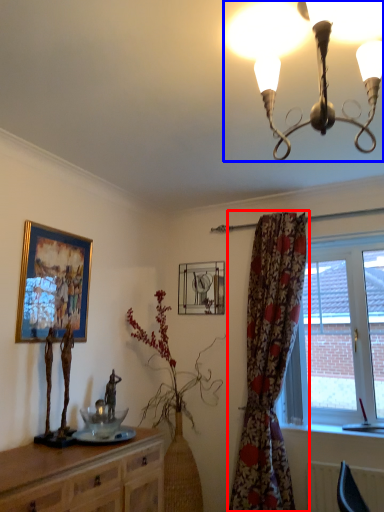
Question: Which point is closer to the camera, curtain (highlighted by a red box) or lamp (highlighted by a blue box)?

Choices:
 (A) curtain
 (B) lamp

Answer: (B)